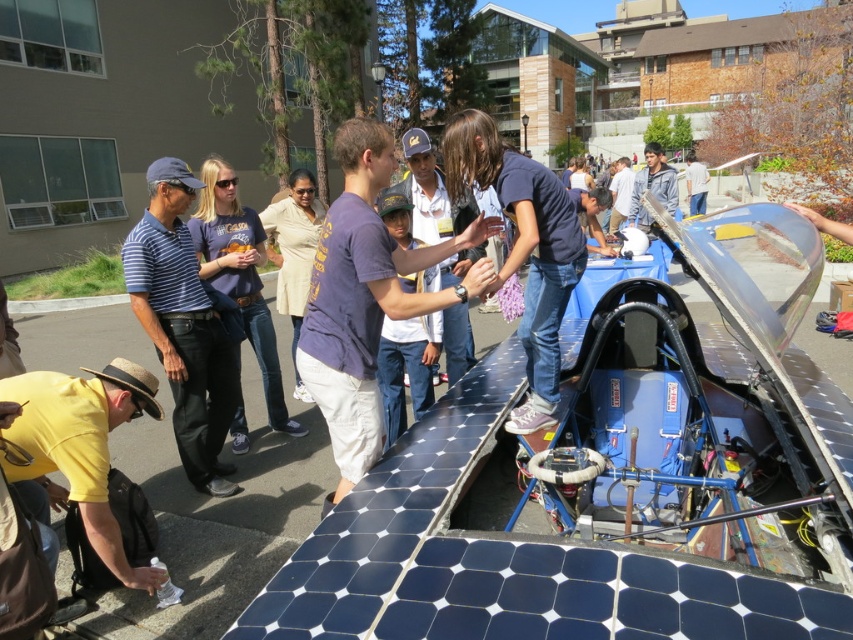
Is point (339, 477) less distant than point (138, 220)?

Yes, it is.

Is purple cotton shirt at center shorter than blue striped shirt at left?

Indeed, purple cotton shirt at center has a lesser height compared to blue striped shirt at left.

Where is `purple cotton shirt at center`? The width and height of the screenshot is (853, 640). purple cotton shirt at center is located at coordinates (366, 298).